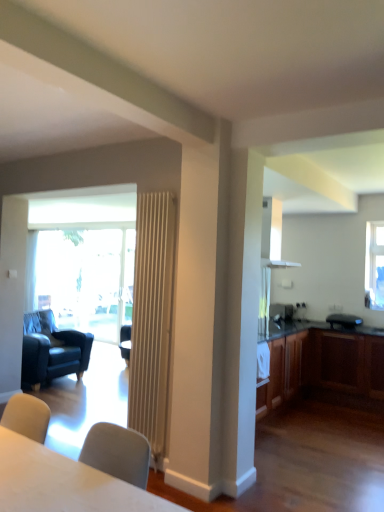
Question: From a real-world perspective, is dark blue leather armchair at left under wooden radiator at center?

Choices:
 (A) yes
 (B) no

Answer: (A)

Question: From the image's perspective, is dark blue leather armchair at left on wooden radiator at center?

Choices:
 (A) yes
 (B) no

Answer: (B)

Question: Is dark blue leather armchair at left to the right of wooden radiator at center from the viewer's perspective?

Choices:
 (A) no
 (B) yes

Answer: (A)

Question: From the image's perspective, is dark blue leather armchair at left under wooden radiator at center?

Choices:
 (A) yes
 (B) no

Answer: (A)

Question: Is dark blue leather armchair at left far from wooden radiator at center?

Choices:
 (A) yes
 (B) no

Answer: (A)

Question: Would you say dark blue leather armchair at left is outside wooden radiator at center?

Choices:
 (A) yes
 (B) no

Answer: (A)

Question: Could you tell me if wooden cabinet at right is facing clear glass window at upper right?

Choices:
 (A) yes
 (B) no

Answer: (B)

Question: Would you say wooden cabinet at right is outside clear glass window at upper right?

Choices:
 (A) no
 (B) yes

Answer: (B)

Question: Is wooden cabinet at right smaller than clear glass window at upper right?

Choices:
 (A) yes
 (B) no

Answer: (B)

Question: From a real-world perspective, is wooden cabinet at right positioned over clear glass window at upper right based on gravity?

Choices:
 (A) no
 (B) yes

Answer: (A)

Question: Is wooden cabinet at right with clear glass window at upper right?

Choices:
 (A) no
 (B) yes

Answer: (A)

Question: Is clear glass window at upper right surrounded by wooden cabinet at right?

Choices:
 (A) yes
 (B) no

Answer: (B)

Question: Is clear glass window at upper right closer to camera compared to satin silver microwave at right?

Choices:
 (A) no
 (B) yes

Answer: (B)